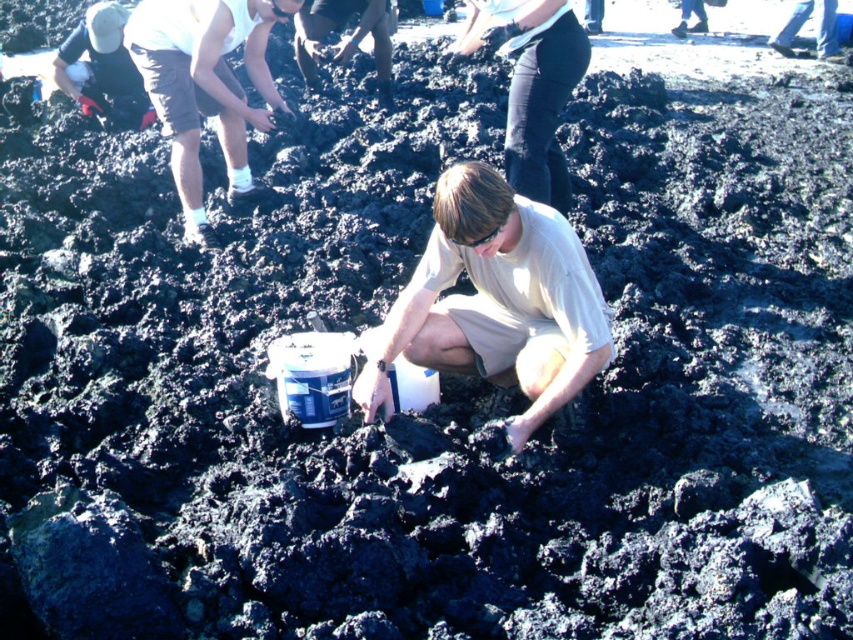
Is point (554, 157) positioned behind point (331, 17)?

No, (554, 157) is in front of (331, 17).

Can you confirm if dark blue jeans at center is positioned above matte black shirt at center?

No.

What do you see at coordinates (532, 84) in the screenshot? I see `dark blue jeans at center` at bounding box center [532, 84].

The image size is (853, 640). Find the location of `dark blue jeans at center`. dark blue jeans at center is located at coordinates (532, 84).

Looking at this image, which of these two, light beige cotton shirt at center or dark blue jeans at center, stands taller?

dark blue jeans at center

Is light beige cotton shirt at center taller than dark blue jeans at center?

Incorrect, light beige cotton shirt at center's height is not larger of dark blue jeans at center's.

Where is `light beige cotton shirt at center`? This screenshot has width=853, height=640. light beige cotton shirt at center is located at coordinates (496, 301).

Which is more to the left, light brown shorts at upper left or matte black shirt at upper left?

Positioned to the left is matte black shirt at upper left.

Is light brown shorts at upper left to the left of matte black shirt at upper left from the viewer's perspective?

In fact, light brown shorts at upper left is to the right of matte black shirt at upper left.

Locate an element on the screen. Image resolution: width=853 pixels, height=640 pixels. light brown shorts at upper left is located at coordinates (206, 84).

Identify the location of light brown shorts at upper left. (206, 84).